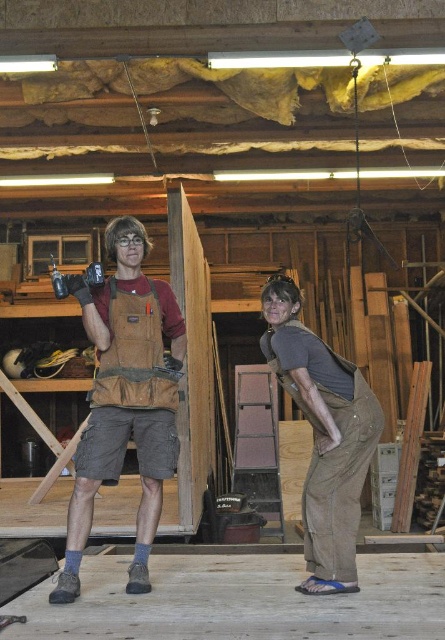
Who is higher up, brown/canvas tool vest at center or brown cotton overalls at lower right?

brown/canvas tool vest at center is above.

Who is positioned more to the right, brown/canvas tool vest at center or brown cotton overalls at lower right?

Positioned to the right is brown cotton overalls at lower right.

What do you see at coordinates (125, 397) in the screenshot?
I see `brown/canvas tool vest at center` at bounding box center [125, 397].

What are the coordinates of `brown/canvas tool vest at center` in the screenshot? It's located at (125, 397).